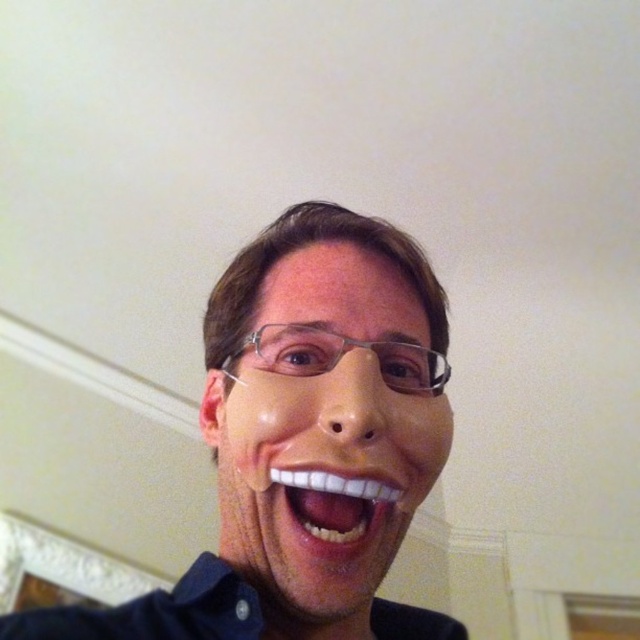
Question: Can you confirm if matte plastic mask at center is thinner than transparent plastic mask at center?

Choices:
 (A) no
 (B) yes

Answer: (A)

Question: Is matte plastic mask at center bigger than white glossy teeth at center?

Choices:
 (A) yes
 (B) no

Answer: (A)

Question: Is matte plastic mask at center above white glossy teeth at center?

Choices:
 (A) no
 (B) yes

Answer: (B)

Question: Among these objects, which one is nearest to the camera?

Choices:
 (A) matte plastic mask at center
 (B) transparent plastic mask at center
 (C) white glossy teeth at center

Answer: (A)

Question: Which point is closer to the camera?

Choices:
 (A) transparent plastic mask at center
 (B) white glossy teeth at center

Answer: (A)

Question: Which point appears farthest from the camera in this image?

Choices:
 (A) (275, 477)
 (B) (228, 589)
 (C) (262, 579)

Answer: (C)